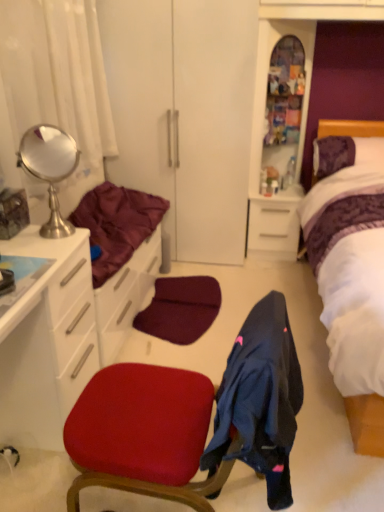
Question: Does white glossy cabinet at left lie in front of purple fabric headboard at upper right?

Choices:
 (A) yes
 (B) no

Answer: (A)

Question: Can you confirm if white glossy cabinet at left is smaller than purple fabric headboard at upper right?

Choices:
 (A) yes
 (B) no

Answer: (B)

Question: Are white glossy cabinet at left and purple fabric headboard at upper right making contact?

Choices:
 (A) no
 (B) yes

Answer: (A)

Question: Can you confirm if white glossy cabinet at left is thinner than purple fabric headboard at upper right?

Choices:
 (A) yes
 (B) no

Answer: (B)

Question: Considering the relative positions of white glossy cabinet at left and purple fabric headboard at upper right in the image provided, is white glossy cabinet at left to the right of purple fabric headboard at upper right from the viewer's perspective?

Choices:
 (A) no
 (B) yes

Answer: (A)

Question: Is velvet red chair at center spatially inside white glossy drawer at center, or outside of it?

Choices:
 (A) outside
 (B) inside

Answer: (A)

Question: Considering the relative positions of velvet red chair at center and white glossy drawer at center in the image provided, is velvet red chair at center to the left or to the right of white glossy drawer at center?

Choices:
 (A) right
 (B) left

Answer: (B)

Question: From their relative heights in the image, would you say velvet red chair at center is taller or shorter than white glossy drawer at center?

Choices:
 (A) tall
 (B) short

Answer: (A)

Question: Considering the positions of velvet red chair at center and white glossy drawer at center in the image, is velvet red chair at center wider or thinner than white glossy drawer at center?

Choices:
 (A) thin
 (B) wide

Answer: (B)

Question: In terms of height, does velvet red chair at center look taller or shorter compared to white glossy cabinet at left?

Choices:
 (A) short
 (B) tall

Answer: (B)

Question: Do you think velvet red chair at center is within white glossy cabinet at left, or outside of it?

Choices:
 (A) inside
 (B) outside

Answer: (B)

Question: From the image's perspective, is velvet red chair at center above or below white glossy cabinet at left?

Choices:
 (A) above
 (B) below

Answer: (B)

Question: Considering the positions of velvet red chair at center and white glossy cabinet at left in the image, is velvet red chair at center bigger or smaller than white glossy cabinet at left?

Choices:
 (A) small
 (B) big

Answer: (A)

Question: Considering their positions, is polished silver mirror at upper left located in front of or behind maroon satin blanket at left?

Choices:
 (A) behind
 (B) front

Answer: (B)

Question: From the image's perspective, is polished silver mirror at upper left located above or below maroon satin blanket at left?

Choices:
 (A) above
 (B) below

Answer: (A)